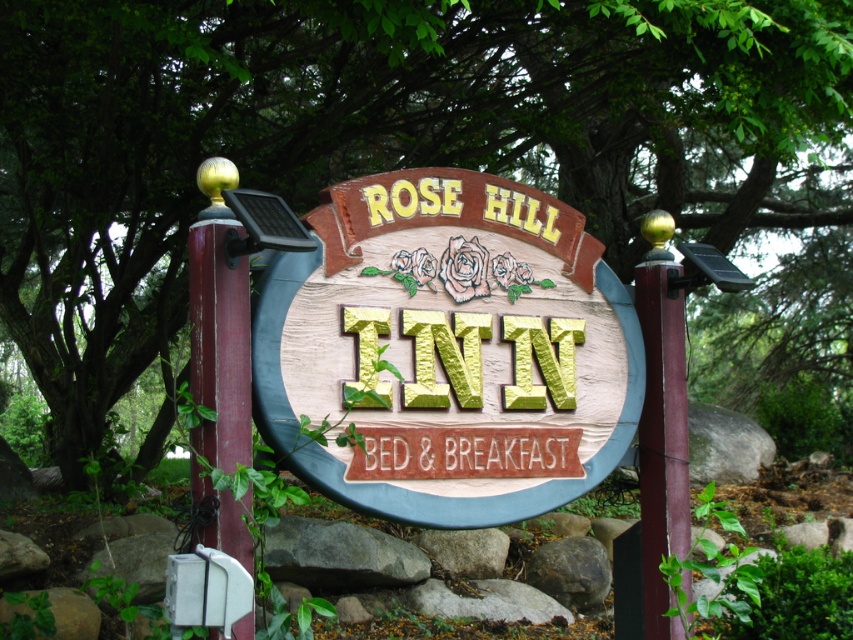
Question: Among these objects, which one is farthest from the camera?

Choices:
 (A) wooden sign at center
 (B) wooden post at left
 (C) smooth burgundy post at center

Answer: (C)

Question: Considering the relative positions of wooden post at left and smooth burgundy post at center in the image provided, where is wooden post at left located with respect to smooth burgundy post at center?

Choices:
 (A) below
 (B) above

Answer: (B)

Question: Does wooden sign at center appear on the left side of wooden post at left?

Choices:
 (A) no
 (B) yes

Answer: (A)

Question: Which object appears closest to the camera in this image?

Choices:
 (A) smooth burgundy post at center
 (B) wooden sign at center
 (C) wooden post at left

Answer: (C)

Question: Among these objects, which one is farthest from the camera?

Choices:
 (A) smooth burgundy post at center
 (B) wooden sign at center
 (C) wooden post at left

Answer: (A)

Question: Is wooden sign at center to the right of smooth burgundy post at center from the viewer's perspective?

Choices:
 (A) yes
 (B) no

Answer: (B)